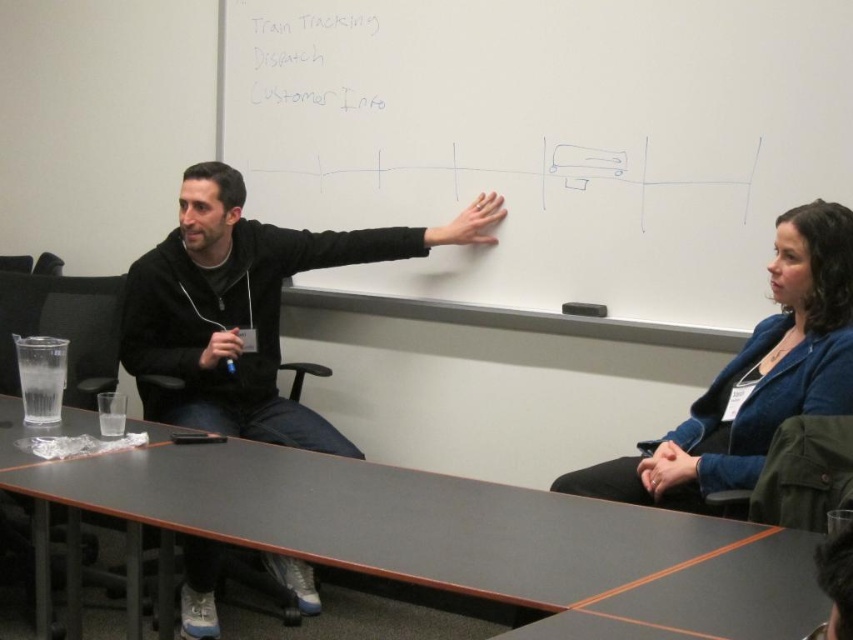
Does white matte board at center lie behind black matte hoodie at upper left?

No.

In the scene shown: Can you confirm if white matte board at center is smaller than black matte hoodie at upper left?

No, white matte board at center is not smaller than black matte hoodie at upper left.

Is point (343, 61) closer to camera compared to point (215, 301)?

No, it is not.

The image size is (853, 640). I want to click on white matte board at center, so click(x=547, y=138).

Which is behind, point (195, 301) or point (813, 340)?

Point (195, 301)

Locate an element on the screen. black matte hoodie at upper left is located at coordinates (247, 307).

Is smooth black table at center above black matte hoodie at upper left?

No, smooth black table at center is not above black matte hoodie at upper left.

Identify the location of smooth black table at center. (447, 532).

Identify the location of smooth black table at center. (447, 532).